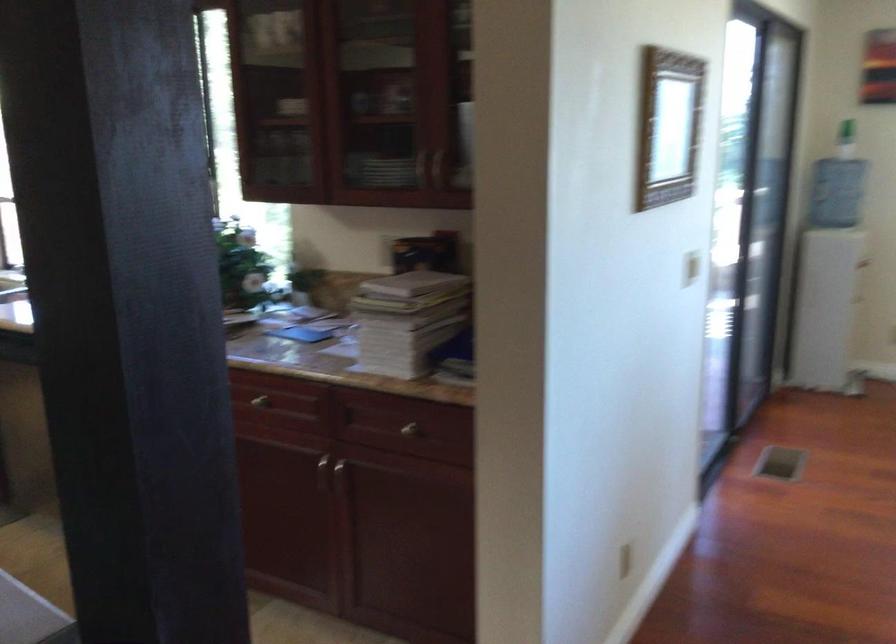
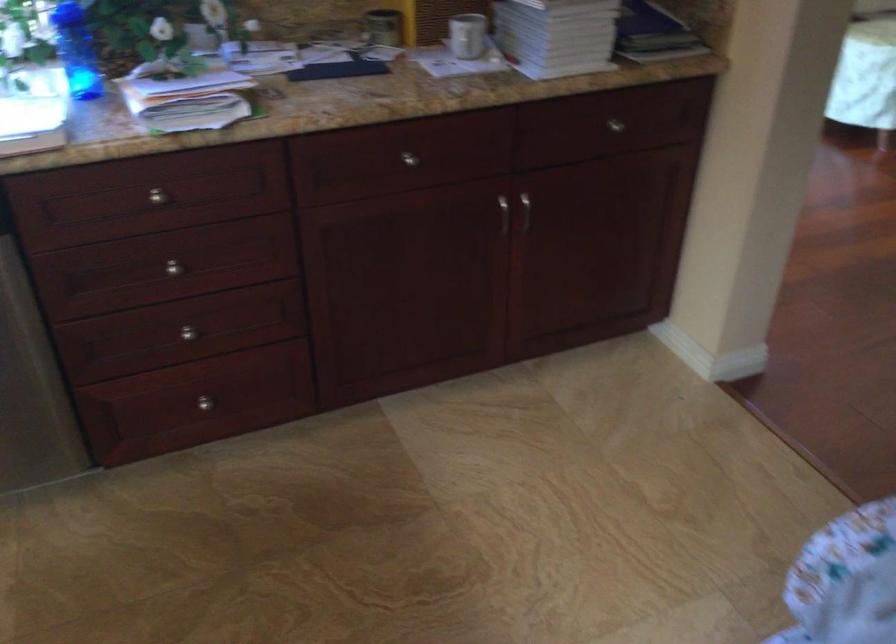
Question: I am providing you with two images of the same scene from different viewpoints. Please identify which objects are invisible in image2.

Choices:
 (A) silver drawer knob
 (B) white coffee mug
 (C) drawer knob
 (D) none of these

Answer: (D)